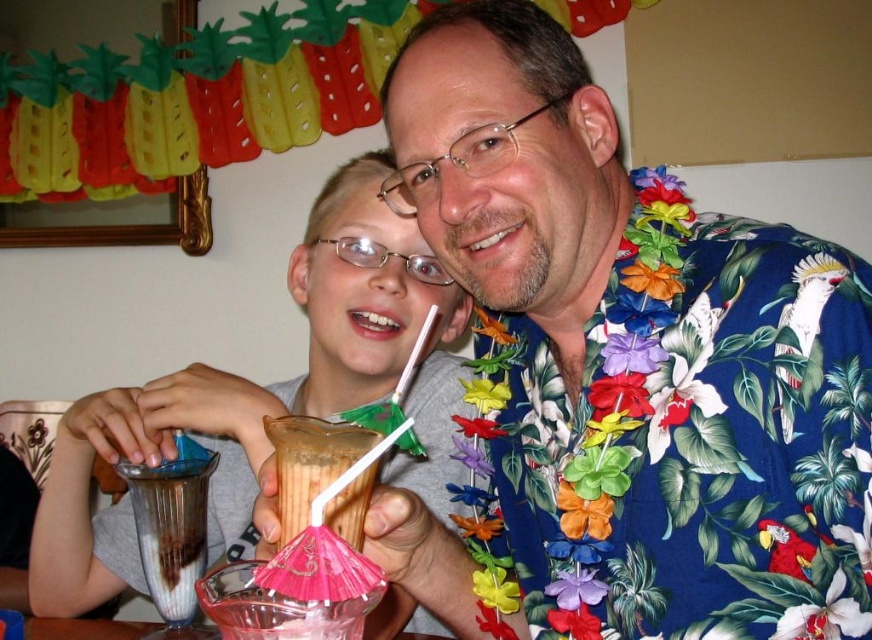
Question: Which object appears farthest from the camera in this image?

Choices:
 (A) smooth plastic cup at center
 (B) translucent plastic cup at center
 (C) blue floral shirt at center

Answer: (A)

Question: Does blue floral shirt at center have a larger size compared to smooth plastic cup at center?

Choices:
 (A) no
 (B) yes

Answer: (A)

Question: Can you confirm if blue floral shirt at center is positioned to the left of smooth plastic cup at center?

Choices:
 (A) yes
 (B) no

Answer: (B)

Question: Which is farther from the blue floral shirt at center?

Choices:
 (A) smooth plastic cup at center
 (B) translucent plastic cup at center

Answer: (A)

Question: Estimate the real-world distances between objects in this image. Which object is closer to the translucent plastic cup at center?

Choices:
 (A) smooth plastic cup at center
 (B) blue floral shirt at center

Answer: (B)

Question: Is smooth plastic cup at center smaller than translucent plastic cup at center?

Choices:
 (A) no
 (B) yes

Answer: (A)